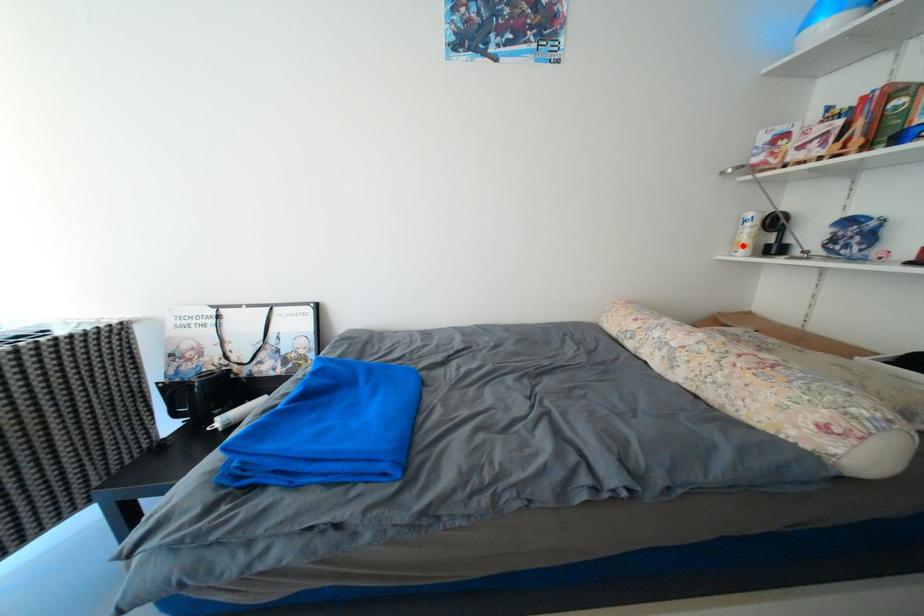
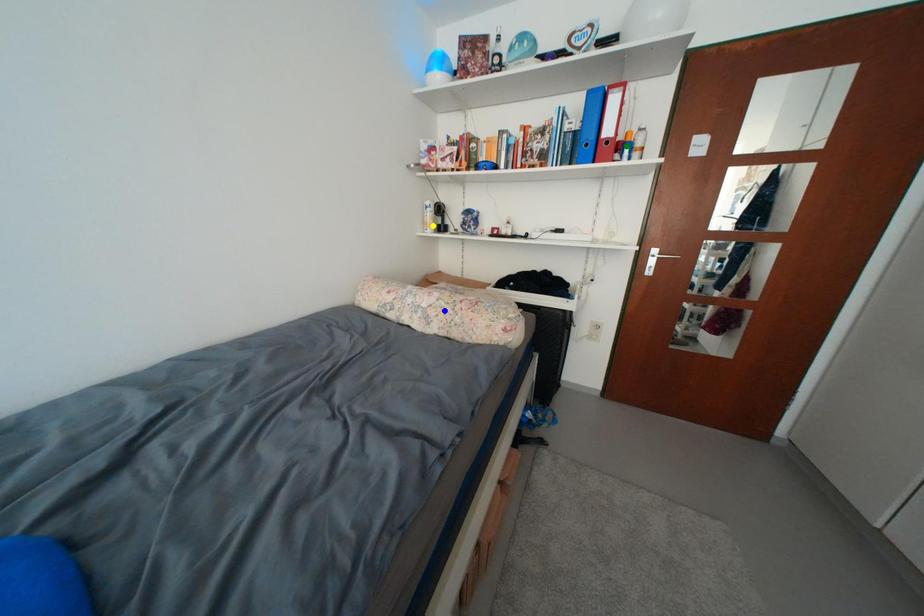
Question: I am providing you with two images of the same scene from different viewpoints. A red point is marked on the first image. You are given multiple points on the second image. Which spot in image 2 lines up with the point in image 1?

Choices:
 (A) green point
 (B) blue point
 (C) yellow point

Answer: (C)